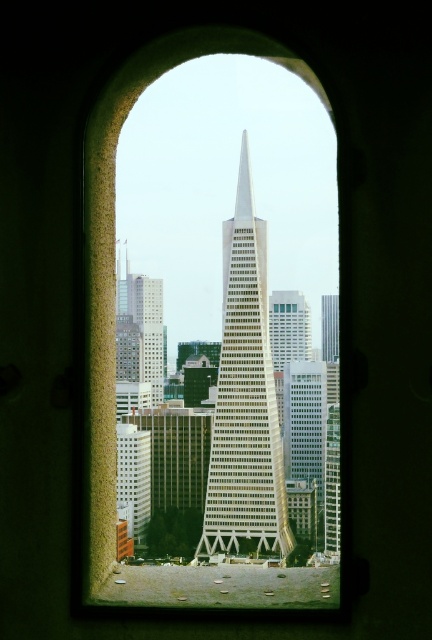
Question: Which point appears closest to the camera in this image?

Choices:
 (A) (330, 305)
 (B) (263, 435)

Answer: (B)

Question: Does white glass skyscraper at center appear under glassy reflective skyscraper at center?

Choices:
 (A) yes
 (B) no

Answer: (A)

Question: Does white glass skyscraper at center appear under glassy reflective skyscraper at center?

Choices:
 (A) yes
 (B) no

Answer: (A)

Question: Is white glass skyscraper at center further to camera compared to glassy reflective skyscraper at center?

Choices:
 (A) no
 (B) yes

Answer: (A)